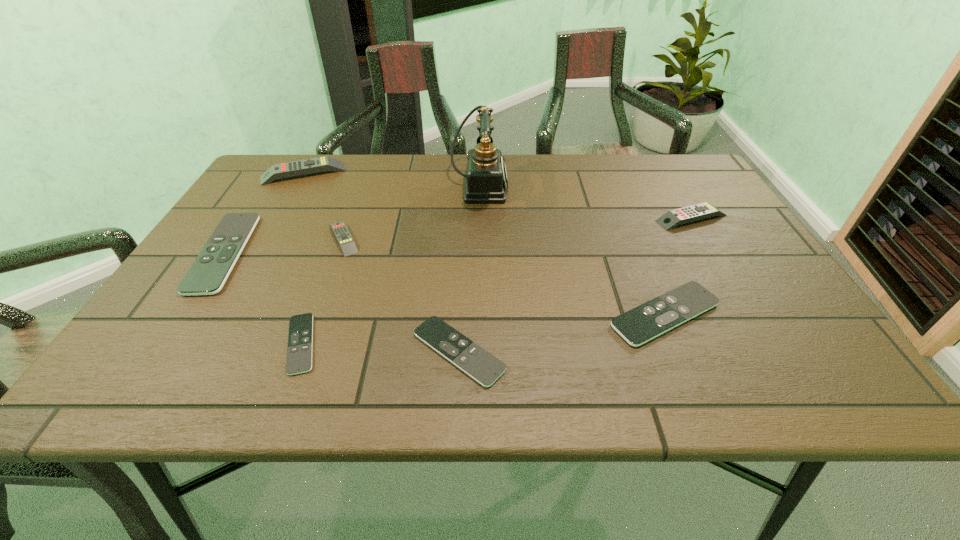
Find the location of a particular element. The height and width of the screenshot is (540, 960). the third shortest remote control is located at coordinates (647, 321).

The height and width of the screenshot is (540, 960). What are the coordinates of `the third shortest object` in the screenshot? It's located at (647, 321).

Where is `the sixth tallest remote control`? Image resolution: width=960 pixels, height=540 pixels. the sixth tallest remote control is located at coordinates (482, 366).

At what (x,y) coordinates should I click in order to perform the action: click on the third black remote control from left to right. Please return your answer as a coordinate pair (x, y). Looking at the image, I should click on (482, 366).

The image size is (960, 540). I want to click on the shortest object, so click(300, 338).

Identify the location of the smallest black remote control. (300, 338).

Where is `free space located on the front of the gray telephone at the rotary dial`? The height and width of the screenshot is (540, 960). free space located on the front of the gray telephone at the rotary dial is located at coordinates (572, 186).

Identify the location of free spot located 0.330m on the right of the leftmost yellow remote control. (456, 173).

The width and height of the screenshot is (960, 540). In order to click on vacant space located 0.050m on the front of the sixth shortest object in this screenshot , I will do `click(706, 243)`.

I want to click on free space located on the front of the second yellow remote control from right to left, so click(300, 359).